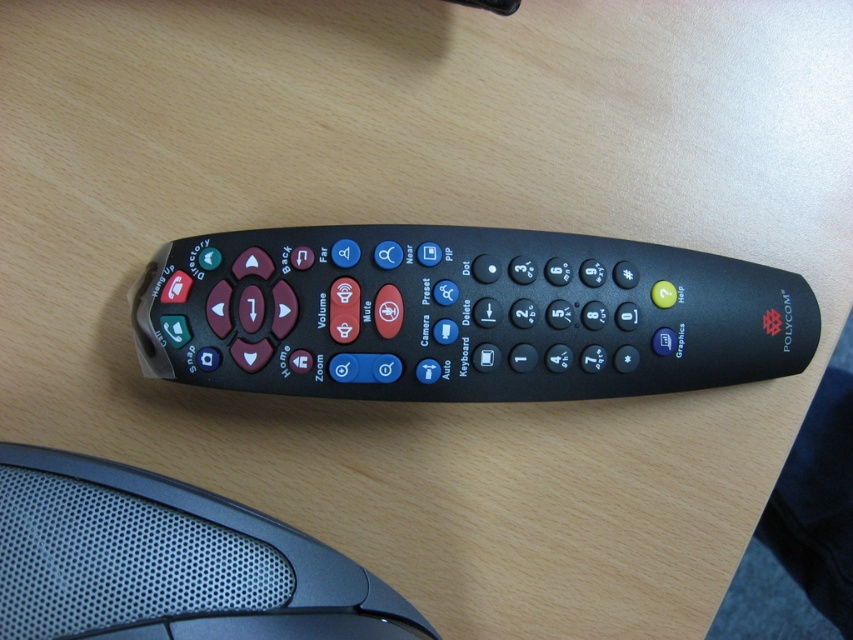
Who is lower down, black plastic remote at center or black textured mouse at lower left?

black textured mouse at lower left

The image size is (853, 640). What are the coordinates of `black plastic remote at center` in the screenshot? It's located at (463, 314).

Where is `black plastic remote at center`? Image resolution: width=853 pixels, height=640 pixels. black plastic remote at center is located at coordinates (463, 314).